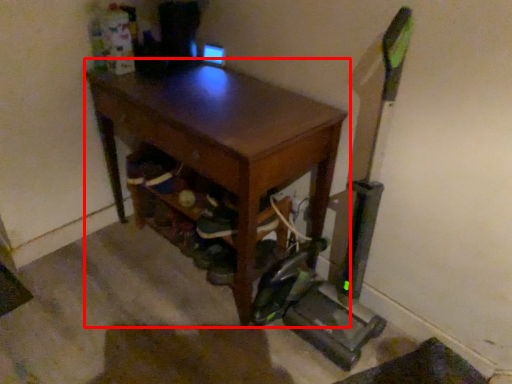
Question: Considering the relative positions of desk (annotated by the red box) and shoe in the image provided, where is desk (annotated by the red box) located with respect to the staircase?

Choices:
 (A) right
 (B) left

Answer: (B)